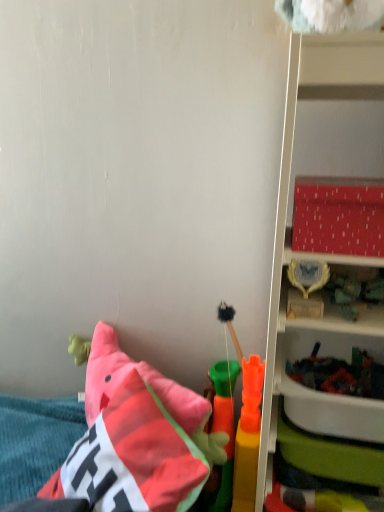
Question: Is smooth plastic toy at lower right, placed as the 3th toy when sorted from back to front, inside rubber carrot at center, acting as the second toy starting from the front?

Choices:
 (A) yes
 (B) no

Answer: (B)

Question: Does rubber carrot at center, which ranks as the second toy in back-to-front order, have a smaller size compared to smooth plastic toy at lower right, which ranks as the first toy in front-to-back order?

Choices:
 (A) yes
 (B) no

Answer: (A)

Question: From the image's perspective, is rubber carrot at center, acting as the second toy starting from the front, on smooth plastic toy at lower right, which ranks as the first toy in front-to-back order?

Choices:
 (A) yes
 (B) no

Answer: (B)

Question: From a real-world perspective, is rubber carrot at center, which ranks as the second toy in back-to-front order, under smooth plastic toy at lower right, placed as the 3th toy when sorted from back to front?

Choices:
 (A) no
 (B) yes

Answer: (B)

Question: Is rubber carrot at center, which ranks as the second toy in back-to-front order, in front of smooth plastic toy at lower right, which ranks as the first toy in front-to-back order?

Choices:
 (A) yes
 (B) no

Answer: (B)

Question: Is rubber carrot at center, acting as the second toy starting from the front, taller or shorter than soft fuzzy brush at center, the 3th toy from the front?

Choices:
 (A) short
 (B) tall

Answer: (B)

Question: Is rubber carrot at center, which ranks as the second toy in back-to-front order, situated inside soft fuzzy brush at center, the 3th toy from the front, or outside?

Choices:
 (A) outside
 (B) inside

Answer: (A)

Question: Is rubber carrot at center, acting as the second toy starting from the front, to the left or to the right of soft fuzzy brush at center, the 3th toy from the front, in the image?

Choices:
 (A) left
 (B) right

Answer: (A)

Question: Considering the positions of rubber carrot at center, which ranks as the second toy in back-to-front order, and soft fuzzy brush at center, the 3th toy from the front, in the image, is rubber carrot at center, which ranks as the second toy in back-to-front order, wider or thinner than soft fuzzy brush at center, the 3th toy from the front,?

Choices:
 (A) thin
 (B) wide

Answer: (B)

Question: From their relative heights in the image, would you say matte red plastic shelf at right is taller or shorter than soft fuzzy brush at center, the 3th toy from the front?

Choices:
 (A) short
 (B) tall

Answer: (B)

Question: Is matte red plastic shelf at right bigger or smaller than soft fuzzy brush at center, the 3th toy from the front?

Choices:
 (A) small
 (B) big

Answer: (B)

Question: From a real-world perspective, is matte red plastic shelf at right physically located above or below soft fuzzy brush at center, which ranks as the first toy in back-to-front order?

Choices:
 (A) above
 (B) below

Answer: (A)

Question: In the image, is matte red plastic shelf at right positioned in front of or behind soft fuzzy brush at center, the 3th toy from the front?

Choices:
 (A) behind
 (B) front

Answer: (B)

Question: From a real-world perspective, is matte red plastic shelf at right above or below rubber carrot at center, which ranks as the second toy in back-to-front order?

Choices:
 (A) below
 (B) above

Answer: (B)

Question: Would you say matte red plastic shelf at right is inside or outside rubber carrot at center, which ranks as the second toy in back-to-front order?

Choices:
 (A) outside
 (B) inside

Answer: (A)